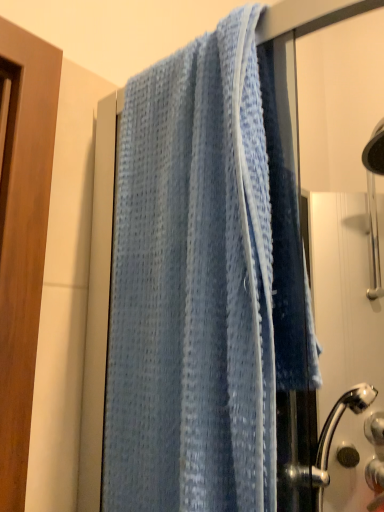
Question: Is light blue waffle-textured towel at center taller than blue fabric towel at right?

Choices:
 (A) yes
 (B) no

Answer: (B)

Question: Would you consider light blue waffle-textured towel at center to be distant from blue fabric towel at right?

Choices:
 (A) no
 (B) yes

Answer: (A)

Question: Considering the relative sizes of light blue waffle-textured towel at center and blue fabric towel at right in the image provided, is light blue waffle-textured towel at center smaller than blue fabric towel at right?

Choices:
 (A) yes
 (B) no

Answer: (B)

Question: Does light blue waffle-textured towel at center appear on the right side of blue fabric towel at right?

Choices:
 (A) yes
 (B) no

Answer: (B)

Question: Is light blue waffle-textured towel at center not within blue fabric towel at right?

Choices:
 (A) yes
 (B) no

Answer: (A)

Question: Would you say satin silver knob at lower right, which appears as the first knob when viewed from the right, is to the left or to the right of matte black knob at lower right, acting as the second knob starting from the right, in the picture?

Choices:
 (A) left
 (B) right

Answer: (B)

Question: Does point (369, 434) appear closer or farther from the camera than point (352, 454)?

Choices:
 (A) closer
 (B) farther

Answer: (B)

Question: Relative to matte black knob at lower right, acting as the second knob starting from the right, is satin silver knob at lower right, which appears as the first knob when viewed from the right, in front or behind?

Choices:
 (A) front
 (B) behind

Answer: (A)

Question: Is satin silver knob at lower right, positioned as the second knob in left-to-right order, spatially inside matte black knob at lower right, acting as the second knob starting from the right, or outside of it?

Choices:
 (A) outside
 (B) inside

Answer: (A)

Question: Considering the positions of blue fabric towel at right and matte black knob at lower right, acting as the second knob starting from the right, in the image, is blue fabric towel at right taller or shorter than matte black knob at lower right, acting as the second knob starting from the right,?

Choices:
 (A) short
 (B) tall

Answer: (B)

Question: Is blue fabric towel at right wider or thinner than matte black knob at lower right, acting as the second knob starting from the right?

Choices:
 (A) wide
 (B) thin

Answer: (A)

Question: Considering the positions of blue fabric towel at right and matte black knob at lower right, the first knob viewed from the left, in the image, is blue fabric towel at right bigger or smaller than matte black knob at lower right, the first knob viewed from the left,?

Choices:
 (A) big
 (B) small

Answer: (A)

Question: Is blue fabric towel at right in front of or behind matte black knob at lower right, acting as the second knob starting from the right, in the image?

Choices:
 (A) behind
 (B) front

Answer: (B)

Question: From a real-world perspective, is satin silver knob at lower right, which appears as the first knob when viewed from the right, above or below blue fabric towel at right?

Choices:
 (A) below
 (B) above

Answer: (A)

Question: Do you think satin silver knob at lower right, positioned as the second knob in left-to-right order, is within blue fabric towel at right, or outside of it?

Choices:
 (A) inside
 (B) outside

Answer: (B)